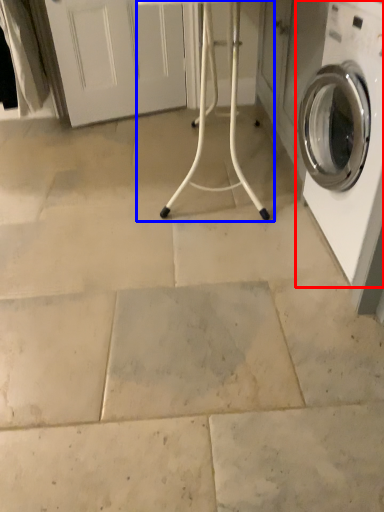
Question: Among these objects, which one is farthest to the camera, washing machine (highlighted by a red box) or table (highlighted by a blue box)?

Choices:
 (A) washing machine
 (B) table

Answer: (B)